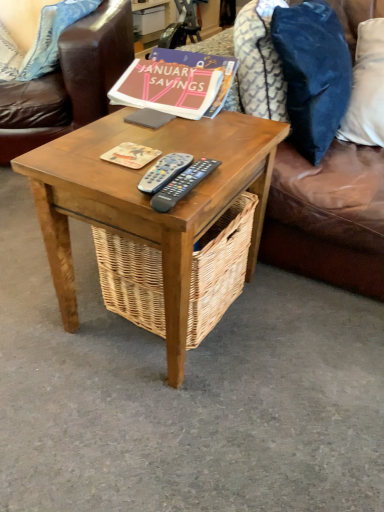
Identify the location of vacant space behind black plastic remote at center, which is the 1th remote control from left to right. (176, 139).